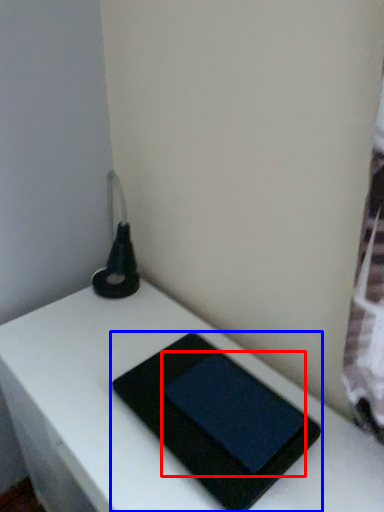
Question: Which object is closer to the camera taking this photo, tablet computer (highlighted by a red box) or tablet computer (highlighted by a blue box)?

Choices:
 (A) tablet computer
 (B) tablet computer

Answer: (B)